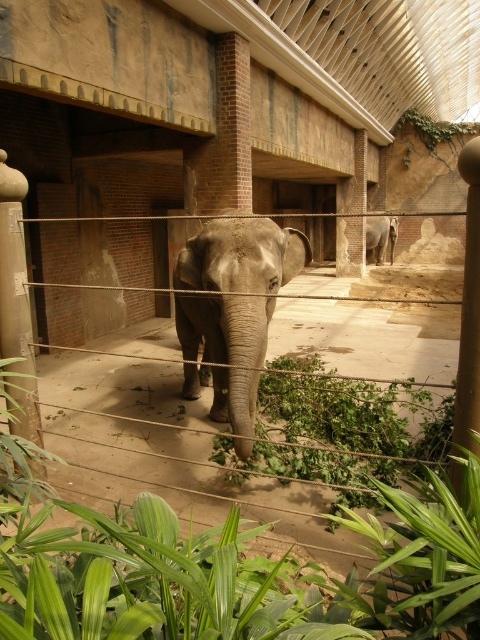
You are a zookeeper standing in front of the enclosure. You need to place a new green leafy plant at lower center exactly 1.5 meters away from where you are standing. Can you place it in the current space?

The green leafy plant at lower center is currently 1.31 meters away from the viewer. To place it 1.5 meters away, you would need to move it 0.19 meters further away from your current position.

Based on the photo, you are a zookeeper who needs to ensure the safety of both visitors and the elephant. The rope barrier is at the front of the enclosure. If the elephant reaches forward with its trunk, could it potentially touch the green leafy plant at lower center or the gray matte elephant at center first?

The green leafy plant at lower center is in front of the gray matte elephant at center, so if the elephant reaches forward with its trunk, it would touch the green leafy plant at lower center first.